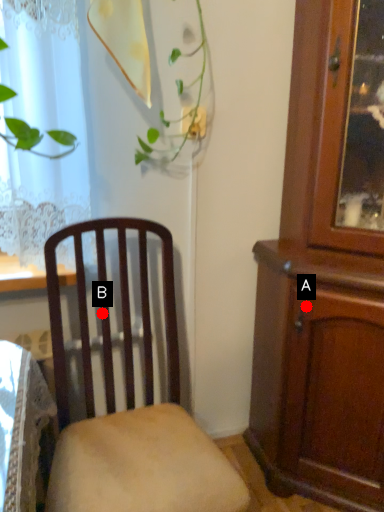
Question: Two points are circled on the image, labeled by A and B beside each circle. Among these points, which one is nearest to the camera?

Choices:
 (A) A is closer
 (B) B is closer

Answer: (B)